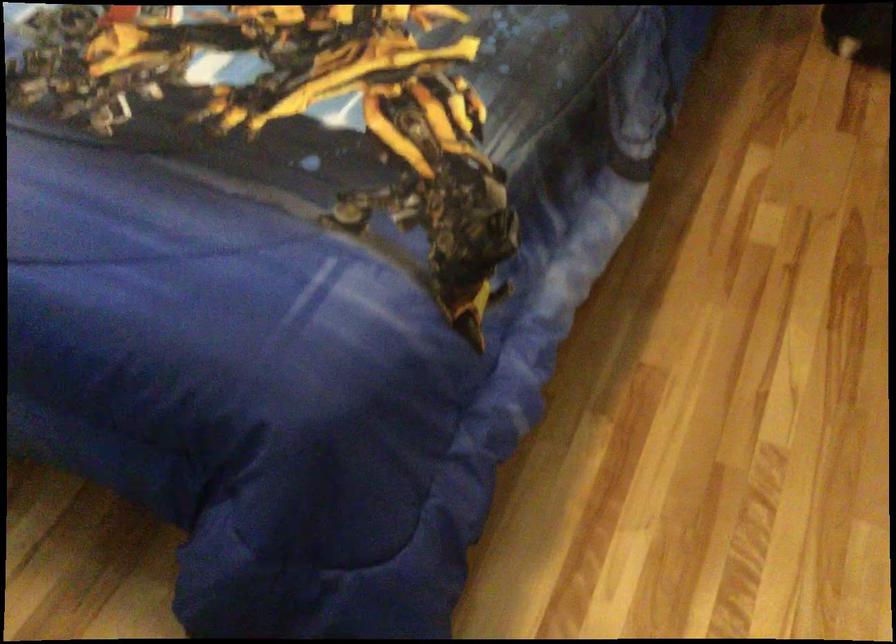
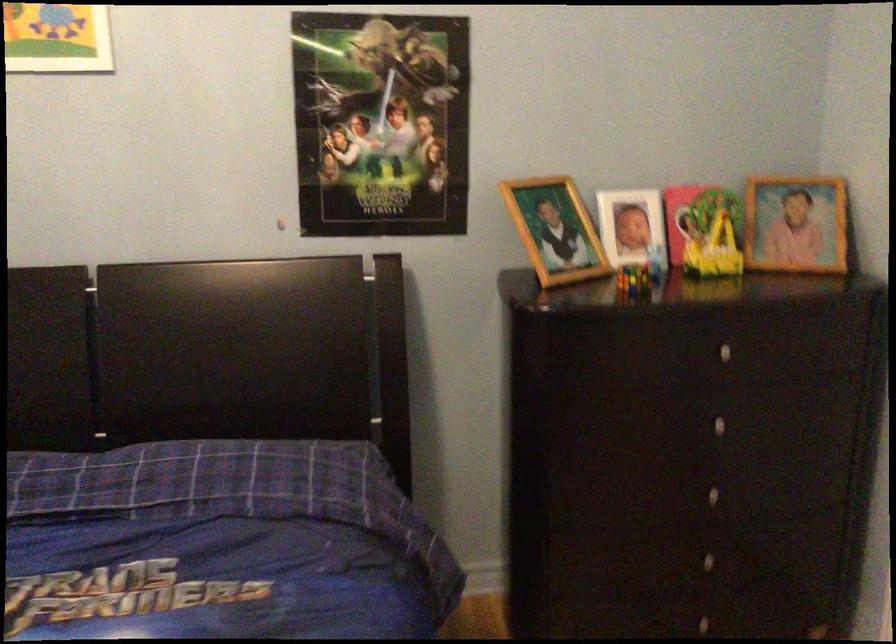
The first image is from the beginning of the video and the second image is from the end. How did the camera likely rotate when shooting the video?

The rotation direction of the camera is right-up.